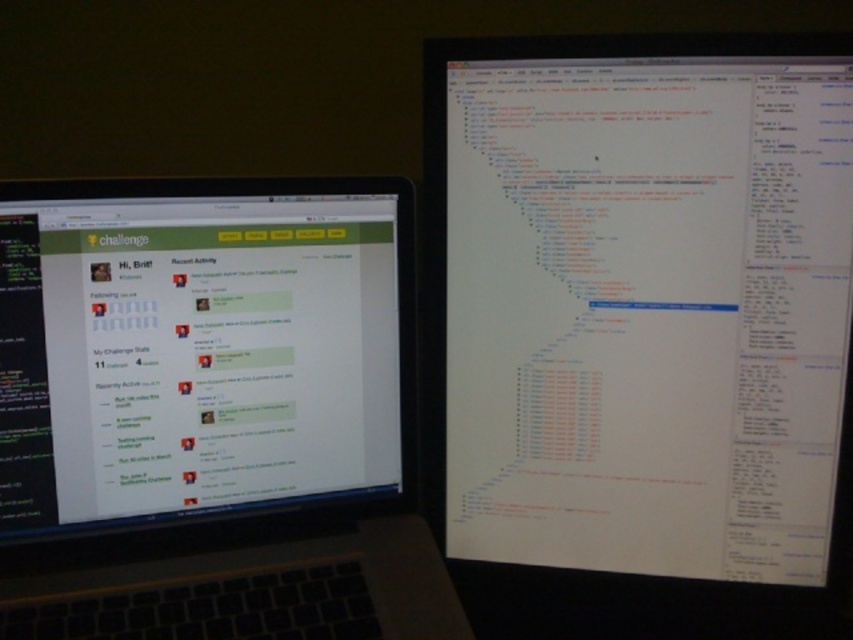
You are working on a project and need to place a white paper at center between the two computer screens. According to the image, where exactly should you position it?

You should position the white paper at center at point coordinates of (642,301).

You are a user trying to reach the white paper at center on your desk. Your hand can extend 28 inches. Can you reach it without moving your body?

The white paper at center is 28.26 inches away from the viewer. Since your hand can only extend 28 inches, you cannot reach the white paper at center without moving your body.